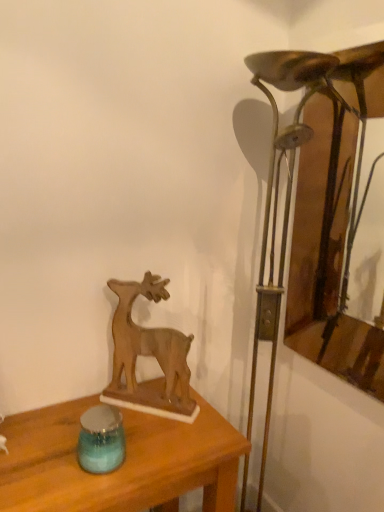
Locate an element on the screen. Image resolution: width=384 pixels, height=512 pixels. vacant area to the left of blue glass candle holder at lower left is located at coordinates (42, 457).